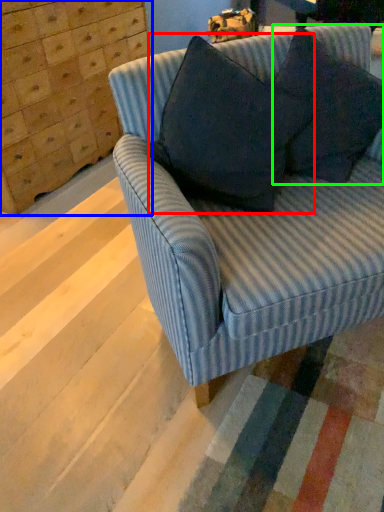
Question: Based on their relative distances, which object is nearer to throw pillow (highlighted by a red box)? Choose from dresser (highlighted by a blue box) and throw pillow (highlighted by a green box).

Choices:
 (A) dresser
 (B) throw pillow

Answer: (B)